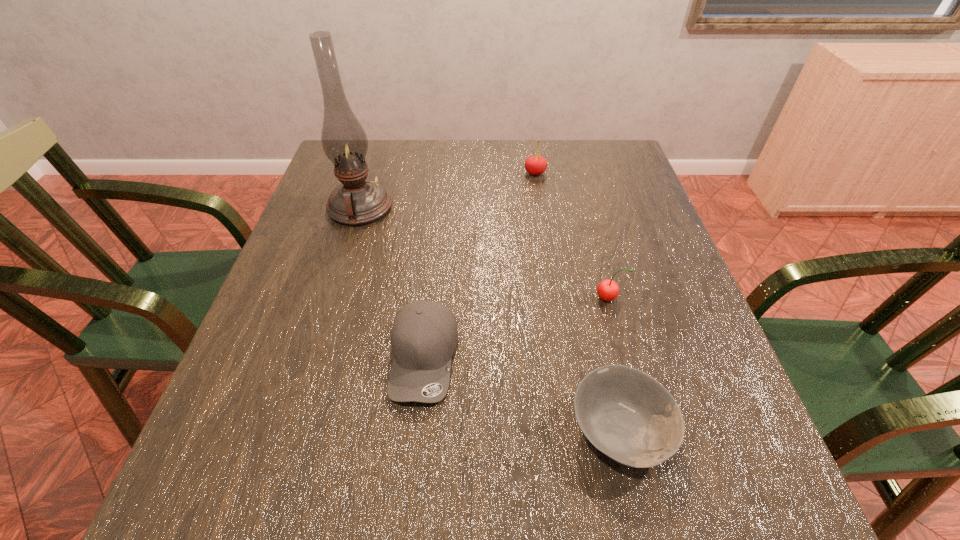
Where is `free location located on the front brim of the second object from left to right`? The height and width of the screenshot is (540, 960). free location located on the front brim of the second object from left to right is located at coordinates (412, 483).

The height and width of the screenshot is (540, 960). In order to click on vacant space located on the right of the third farthest object in this screenshot , I will do `click(655, 298)`.

Where is `vacant space located on the back of the shortest object`? vacant space located on the back of the shortest object is located at coordinates (589, 295).

At what (x,y) coordinates should I click in order to perform the action: click on object that is at the far edge. Please return your answer as a coordinate pair (x, y). The height and width of the screenshot is (540, 960). Looking at the image, I should click on (535, 165).

I want to click on object positioned at the near edge, so click(629, 416).

Locate an element on the screen. The image size is (960, 540). object that is at the left edge is located at coordinates (357, 201).

Image resolution: width=960 pixels, height=540 pixels. I want to click on cherry located at the right edge, so click(x=608, y=290).

In order to click on bowl situated at the right edge in this screenshot , I will do `click(629, 416)`.

Where is `object that is at the near right corner`? This screenshot has height=540, width=960. object that is at the near right corner is located at coordinates (629, 416).

This screenshot has width=960, height=540. I want to click on free location at the far edge of the desktop, so (x=505, y=156).